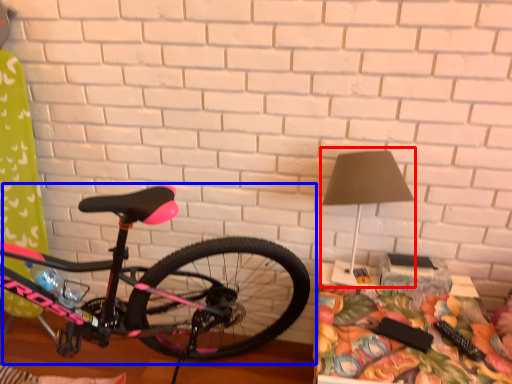
Question: Which of the following is the closest to the observer, table lamp (highlighted by a red box) or bicycle (highlighted by a blue box)?

Choices:
 (A) table lamp
 (B) bicycle

Answer: (B)